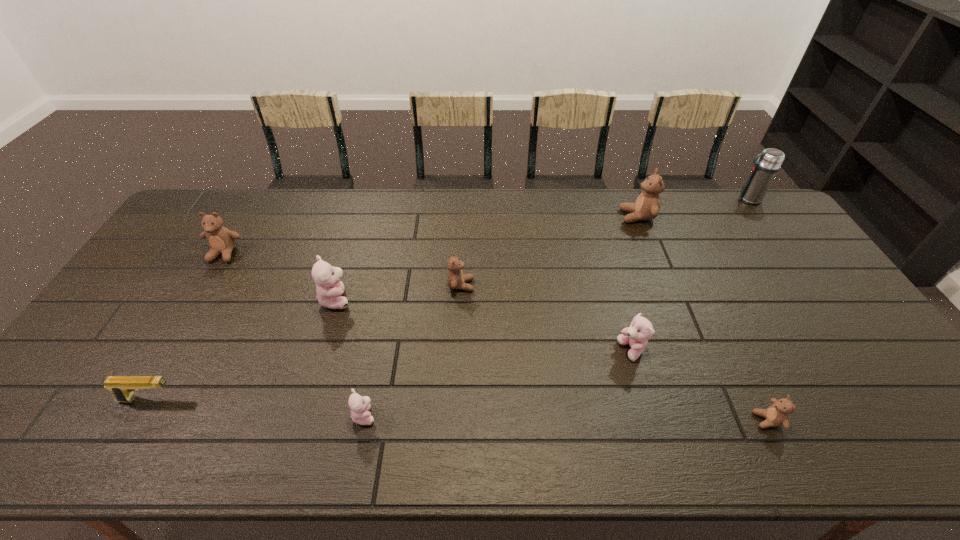
The width and height of the screenshot is (960, 540). I want to click on empty location between the second object from right to left and the rightmost pink teddy bear, so click(x=700, y=386).

The width and height of the screenshot is (960, 540). Find the location of `vacant region between the fifth object from left to right and the smallest pink teddy bear`. vacant region between the fifth object from left to right and the smallest pink teddy bear is located at coordinates (413, 350).

Image resolution: width=960 pixels, height=540 pixels. In order to click on vacant space in between the pistol and the fourth teddy bear from left to right in this screenshot , I will do `click(305, 342)`.

Locate which object is the eighth closest to the tan pistol. Please provide its 2D coordinates. Your answer should be formatted as a tuple, i.e. [(x, y)], where the tuple contains the x and y coordinates of a point satisfying the conditions above.

[(764, 171)]

Identify which object is located as the seventh nearest to the biggest brown teddy bear. Please provide its 2D coordinates. Your answer should be formatted as a tuple, i.e. [(x, y)], where the tuple contains the x and y coordinates of a point satisfying the conditions above.

[(221, 240)]

What are the coordinates of `teddy bear that stands as the second closest to the seventh farthest object` in the screenshot? It's located at (360, 406).

Identify which teddy bear is located as the third nearest to the leftmost pink teddy bear. Please provide its 2D coordinates. Your answer should be formatted as a tuple, i.e. [(x, y)], where the tuple contains the x and y coordinates of a point satisfying the conditions above.

[(221, 240)]

Locate an element on the screen. This screenshot has width=960, height=540. the third closest brown teddy bear relative to the nearest pink teddy bear is located at coordinates (777, 414).

Select which brown teddy bear appears as the third closest to the second smallest pink teddy bear. Please provide its 2D coordinates. Your answer should be formatted as a tuple, i.e. [(x, y)], where the tuple contains the x and y coordinates of a point satisfying the conditions above.

[(647, 206)]

Image resolution: width=960 pixels, height=540 pixels. I want to click on pink teddy bear that is the third closest to the third nearest object, so click(641, 330).